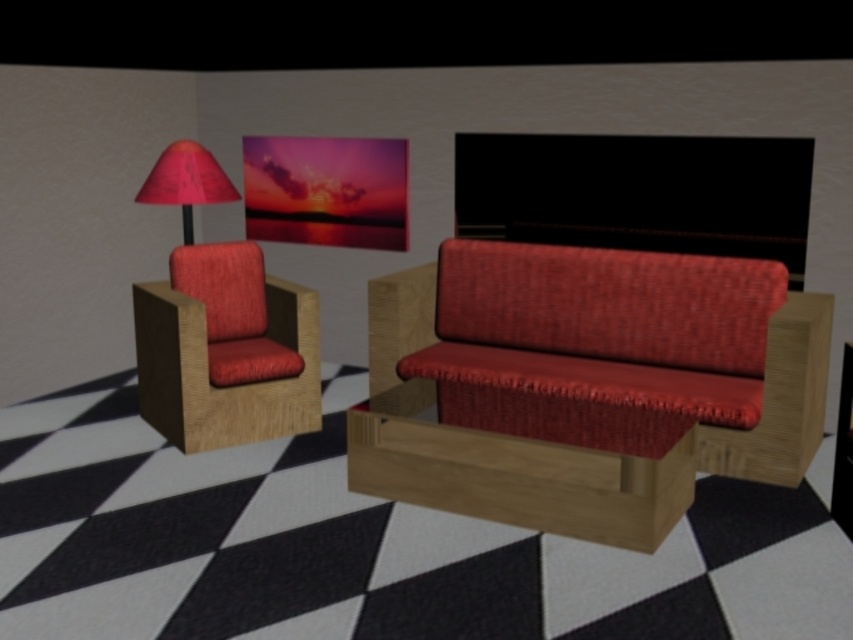
Question: Among these objects, which one is farthest from the camera?

Choices:
 (A) matte red lampshade at upper left
 (B) matte wood armchair at left

Answer: (A)

Question: Does matte red fabric couch at center appear on the right side of matte red lampshade at upper left?

Choices:
 (A) yes
 (B) no

Answer: (A)

Question: In this image, where is matte wood armchair at left located relative to matte red lampshade at upper left?

Choices:
 (A) above
 (B) below

Answer: (B)

Question: Observing the image, what is the correct spatial positioning of matte wood armchair at left in reference to matte red lampshade at upper left?

Choices:
 (A) above
 (B) below

Answer: (B)

Question: Which object appears closest to the camera in this image?

Choices:
 (A) matte red lampshade at upper left
 (B) matte wood armchair at left

Answer: (B)

Question: Considering the real-world distances, which object is closest to the matte wood armchair at left?

Choices:
 (A) matte red fabric couch at center
 (B) matte red lampshade at upper left

Answer: (B)